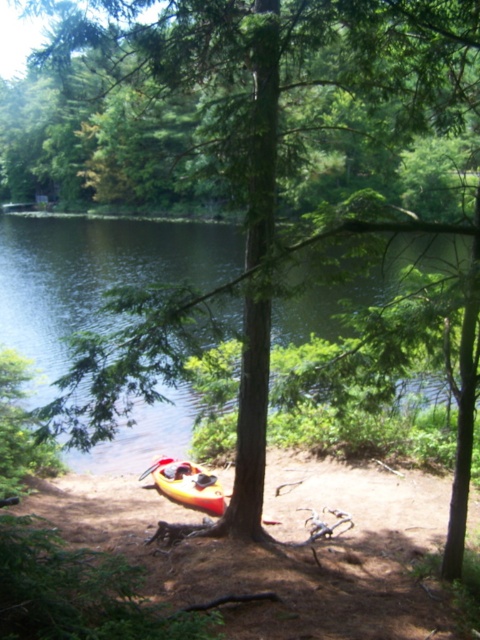
Question: Estimate the real-world distances between objects in this image. Which object is farther from the yellow plastic kayak at lower center?

Choices:
 (A) green liquid water at lower center
 (B) orange kayak at lower center

Answer: (A)

Question: Is green liquid water at lower center to the right of yellow plastic kayak at lower center from the viewer's perspective?

Choices:
 (A) no
 (B) yes

Answer: (B)

Question: Which object is positioned closest to the green liquid water at lower center?

Choices:
 (A) orange kayak at lower center
 (B) yellow plastic kayak at lower center

Answer: (B)

Question: Which of these objects is positioned farthest from the yellow plastic kayak at lower center?

Choices:
 (A) green liquid water at lower center
 (B) orange kayak at lower center

Answer: (A)

Question: Is orange kayak at lower center closer to the viewer compared to yellow plastic kayak at lower center?

Choices:
 (A) no
 (B) yes

Answer: (B)

Question: Can you confirm if orange kayak at lower center is bigger than green liquid water at lower center?

Choices:
 (A) yes
 (B) no

Answer: (B)